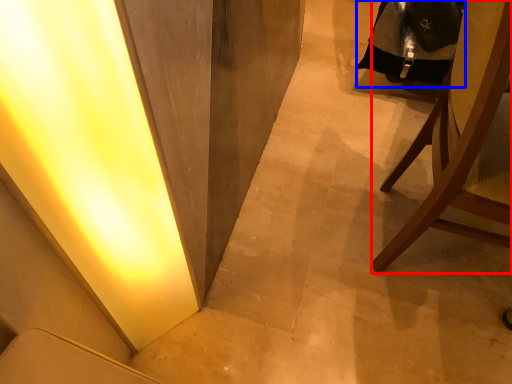
Question: Which object is closer to the camera taking this photo, chair (highlighted by a red box) or robe (highlighted by a blue box)?

Choices:
 (A) chair
 (B) robe

Answer: (A)